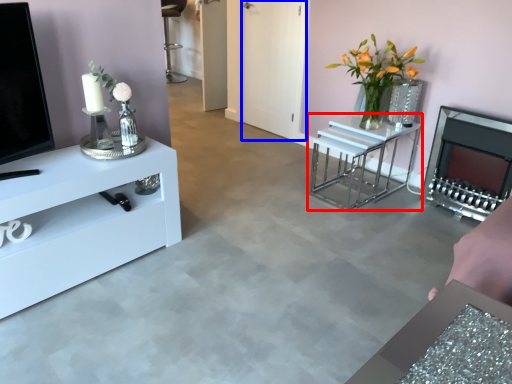
Question: Which object is closer to the camera taking this photo, table (highlighted by a red box) or glass door (highlighted by a blue box)?

Choices:
 (A) table
 (B) glass door

Answer: (A)